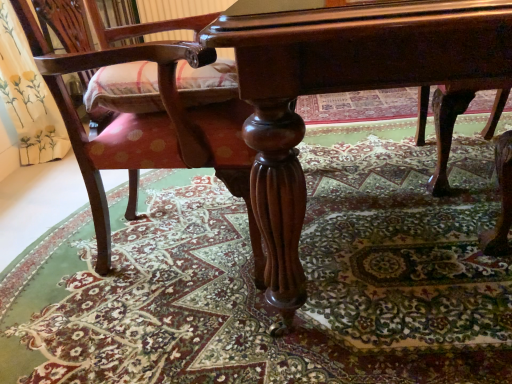
Question: Visually, is polished dark wood table at center positioned to the left or to the right of polished wood chair at lower left?

Choices:
 (A) left
 (B) right

Answer: (B)

Question: From a real-world perspective, relative to polished wood chair at lower left, is polished dark wood table at center vertically above or below?

Choices:
 (A) below
 (B) above

Answer: (A)

Question: Which of these objects is positioned closest to the polished dark wood table at center?

Choices:
 (A) carpeted floor at center
 (B) polished wood chair at lower left

Answer: (B)

Question: Based on their relative distances, which object is farther from the carpeted floor at center?

Choices:
 (A) polished wood chair at lower left
 (B) polished dark wood table at center

Answer: (B)